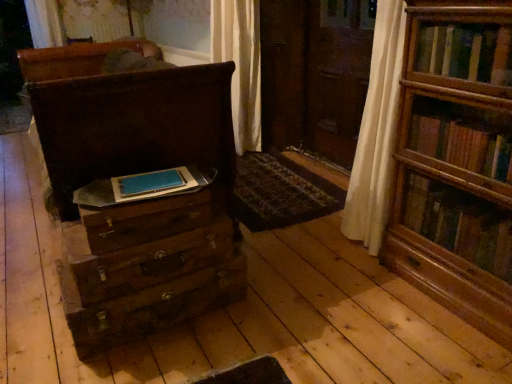
This screenshot has height=384, width=512. Describe the element at coordinates (456, 161) in the screenshot. I see `wooden bookshelf at right` at that location.

What do you see at coordinates (281, 192) in the screenshot? I see `patterned carpet at center` at bounding box center [281, 192].

Locate an element on the screen. The width and height of the screenshot is (512, 384). matte brown chest of drawers at left is located at coordinates (140, 200).

Locate an element on the screen. The image size is (512, 384). wooden drawer at center, marked as the third drawer in a top-to-bottom arrangement is located at coordinates (153, 306).

The height and width of the screenshot is (384, 512). I want to click on wooden bookshelf at right, so click(456, 161).

Consider the image. Is patterned carpet at center wider or thinner than matte brown chest of drawers at left?

patterned carpet at center is thinner than matte brown chest of drawers at left.

Which of these two, patterned carpet at center or matte brown chest of drawers at left, is bigger?

matte brown chest of drawers at left.

Where is `mat lying below the matte brown chest of drawers at left (from the image's perspective)`? mat lying below the matte brown chest of drawers at left (from the image's perspective) is located at coordinates (281, 192).

Which is in front, patterned carpet at center or matte brown chest of drawers at left?

matte brown chest of drawers at left is in front.

From the picture: Is wooden drawer at center, the 1th drawer in the bottom-to-top sequence, aimed at patterned carpet at center?

No, wooden drawer at center, the 1th drawer in the bottom-to-top sequence, is not turned towards patterned carpet at center.

Is wooden drawer at center, the 1th drawer in the bottom-to-top sequence, at the left side of patterned carpet at center?

Yes, wooden drawer at center, the 1th drawer in the bottom-to-top sequence, is to the left of patterned carpet at center.

Is wooden drawer at center, marked as the third drawer in a top-to-bottom arrangement, far away from wooden drawer at center, which is the second drawer from bottom to top?

wooden drawer at center, marked as the third drawer in a top-to-bottom arrangement, is actually quite close to wooden drawer at center, which is the second drawer from bottom to top.

Which of these two, wooden drawer at center, the 1th drawer in the bottom-to-top sequence, or wooden drawer at center, which is the second drawer from bottom to top, is smaller?

wooden drawer at center, which is the second drawer from bottom to top, is smaller.

Is wooden drawer at center, marked as the third drawer in a top-to-bottom arrangement, positioned with its back to wooden drawer at center, the second drawer positioned from the top?

wooden drawer at center, marked as the third drawer in a top-to-bottom arrangement, is not turned away from wooden drawer at center, the second drawer positioned from the top.

Is wooden drawer at center, which is the second drawer from bottom to top, inside wooden drawer at center, marked as the third drawer in a top-to-bottom arrangement?

Actually, wooden drawer at center, which is the second drawer from bottom to top, is outside wooden drawer at center, marked as the third drawer in a top-to-bottom arrangement.

Is point (117, 316) closer or farther from the camera than point (201, 292)?

Point (117, 316) is positioned closer to the camera compared to point (201, 292).

From the picture: In terms of height, does matte brown chest of drawers at left look taller or shorter compared to wooden drawer at center, the 1th drawer in the bottom-to-top sequence?

Clearly, matte brown chest of drawers at left is taller compared to wooden drawer at center, the 1th drawer in the bottom-to-top sequence.

Can you confirm if matte brown chest of drawers at left is bigger than wooden drawer at center, marked as the third drawer in a top-to-bottom arrangement?

Yes.

At what (x,y) coordinates should I click in order to perform the action: click on mat beneath the matte brown chest of drawers at left (from a real-world perspective). Please return your answer as a coordinate pair (x, y). Image resolution: width=512 pixels, height=384 pixels. Looking at the image, I should click on (281, 192).

Considering the positions of objects matte brown chest of drawers at left and patterned carpet at center in the image provided, who is more to the left, matte brown chest of drawers at left or patterned carpet at center?

matte brown chest of drawers at left is more to the left.

How different are the orientations of matte brown chest of drawers at left and patterned carpet at center in degrees?

matte brown chest of drawers at left and patterned carpet at center are facing 3.92 degrees away from each other.

Who is more distant, matte brown chest of drawers at left or patterned carpet at center?

patterned carpet at center is further from the camera.

From the image's perspective, is matte brown chest of drawers at left located above or below wooden drawer at lower left, the 1th drawer when ordered from top to bottom?

Clearly, from the image's perspective, matte brown chest of drawers at left is above wooden drawer at lower left, the 1th drawer when ordered from top to bottom.

You are a GUI agent. You are given a task and a screenshot of the screen. Output one action in this format:
    pyautogui.click(x=<x>, y=<y>)
    Task: Click on the drawer that is in front of the matte brown chest of drawers at left
    
    Given the screenshot: What is the action you would take?
    pyautogui.click(x=147, y=220)

Is matte brown chest of drawers at left far away from wooden drawer at lower left, which appears as the third drawer when ordered from the bottom?

They are positioned close to each other.

Is wooden bookshelf at right outside of wooden drawer at center, marked as the third drawer in a top-to-bottom arrangement?

Yes, wooden bookshelf at right is located beyond the bounds of wooden drawer at center, marked as the third drawer in a top-to-bottom arrangement.

From the image's perspective, is wooden bookshelf at right beneath wooden drawer at center, the 1th drawer in the bottom-to-top sequence?

Actually, wooden bookshelf at right appears above wooden drawer at center, the 1th drawer in the bottom-to-top sequence, in the image.

From a real-world perspective, is wooden bookshelf at right under wooden drawer at center, the 1th drawer in the bottom-to-top sequence?

No, from a real-world perspective, wooden bookshelf at right is not beneath wooden drawer at center, the 1th drawer in the bottom-to-top sequence.

Considering the sizes of wooden bookshelf at right and wooden drawer at center, the 1th drawer in the bottom-to-top sequence, in the image, is wooden bookshelf at right taller or shorter than wooden drawer at center, the 1th drawer in the bottom-to-top sequence,?

In the image, wooden bookshelf at right appears to be taller than wooden drawer at center, the 1th drawer in the bottom-to-top sequence.

This screenshot has width=512, height=384. I want to click on mat directly beneath the matte brown chest of drawers at left (from a real-world perspective), so click(281, 192).

The width and height of the screenshot is (512, 384). I want to click on the 1st drawer in front of the patterned carpet at center, starting your count from the anchor, so click(x=153, y=306).

From the picture: Based on their spatial positions, is blue matte paper at center or wooden drawer at lower left, the 1th drawer when ordered from top to bottom, closer to patterned carpet at center?

The object closer to patterned carpet at center is wooden drawer at lower left, the 1th drawer when ordered from top to bottom.

Looking at the image, which one is located closer to patterned carpet at center, wooden bookshelf at right or wooden drawer at center, the 1th drawer in the bottom-to-top sequence?

wooden drawer at center, the 1th drawer in the bottom-to-top sequence.

Looking at the image, which one is located further to matte brown chest of drawers at left, wooden drawer at center, marked as the third drawer in a top-to-bottom arrangement, or blue matte paper at center?

blue matte paper at center lies further to matte brown chest of drawers at left than the other object.

Estimate the real-world distances between objects in this image. Which object is closer to wooden bookshelf at right, matte brown chest of drawers at left or wooden drawer at lower left, the 1th drawer when ordered from top to bottom?

The object closer to wooden bookshelf at right is matte brown chest of drawers at left.

Based on their spatial positions, is wooden drawer at center, which is the second drawer from bottom to top, or wooden drawer at lower left, which appears as the third drawer when ordered from the bottom, closer to matte brown chest of drawers at left?

Based on the image, wooden drawer at lower left, which appears as the third drawer when ordered from the bottom, appears to be nearer to matte brown chest of drawers at left.

From the image, which object appears to be farther from wooden drawer at center, marked as the third drawer in a top-to-bottom arrangement, wooden drawer at lower left, which appears as the third drawer when ordered from the bottom, or patterned carpet at center?

patterned carpet at center lies further to wooden drawer at center, marked as the third drawer in a top-to-bottom arrangement, than the other object.

Considering their positions, is blue matte paper at center positioned further to wooden bookshelf at right than matte brown chest of drawers at left?

Among the two, blue matte paper at center is located further to wooden bookshelf at right.

Based on their spatial positions, is blue matte paper at center or patterned carpet at center closer to wooden drawer at lower left, the 1th drawer when ordered from top to bottom?

Based on the image, blue matte paper at center appears to be nearer to wooden drawer at lower left, the 1th drawer when ordered from top to bottom.

Find the location of `paperback book located between wooden drawer at center, the 1th drawer in the bottom-to-top sequence, and wooden bookshelf at right in the left-right direction`. paperback book located between wooden drawer at center, the 1th drawer in the bottom-to-top sequence, and wooden bookshelf at right in the left-right direction is located at coordinates (152, 184).

Identify the location of paperback book between matte brown chest of drawers at left and wooden bookshelf at right. (152, 184).

Identify the location of paperback book between matte brown chest of drawers at left and patterned carpet at center in the front-back direction. (152, 184).

Where is `paperback book between matte brown chest of drawers at left and wooden drawer at center, the 1th drawer in the bottom-to-top sequence, vertically`? Image resolution: width=512 pixels, height=384 pixels. paperback book between matte brown chest of drawers at left and wooden drawer at center, the 1th drawer in the bottom-to-top sequence, vertically is located at coordinates (152, 184).